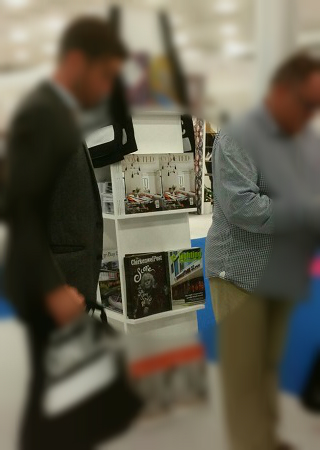
The image size is (320, 450). In order to click on ivory covered book in this screenshot , I will do `click(146, 178)`.